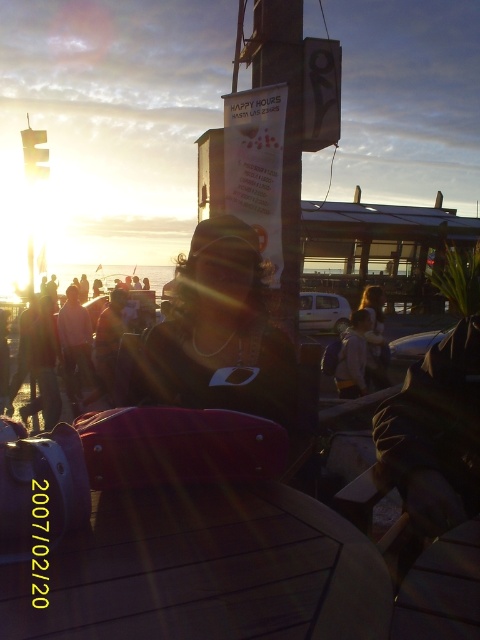
You are trying to place a small decorative vase on the wooden table at center. The vase is 10 cm tall. Considering the height of the light brown leather jacket at center, do you think the vase will be visible from above the table?

The wooden table at center has a lesser height compared to the light brown leather jacket at center. Since the table is shorter than the jacket, the vase placed on it may not be fully visible from above, especially if the jacket is positioned near the edge of the table.

You are planning to place a new chair next to the wooden table at center. The chair you have is as wide as the light brown leather jacket at center. Will the chair fit next to the table without overlapping?

The wooden table at center might be wider than light brown leather jacket at center, so there is a possibility that the chair will not fit next to the table without overlapping. It is recommended to measure the exact dimensions before placing the chair.

You are standing at the camera position and want to place a 24 inch wide object on the ground between you and the wooden table at center. Will the object fit without overlapping the table?

The wooden table at center is 25.27 inches away from the camera. Since the object is 24 inches wide, it can be placed between you and the table without overlapping as there is enough space.